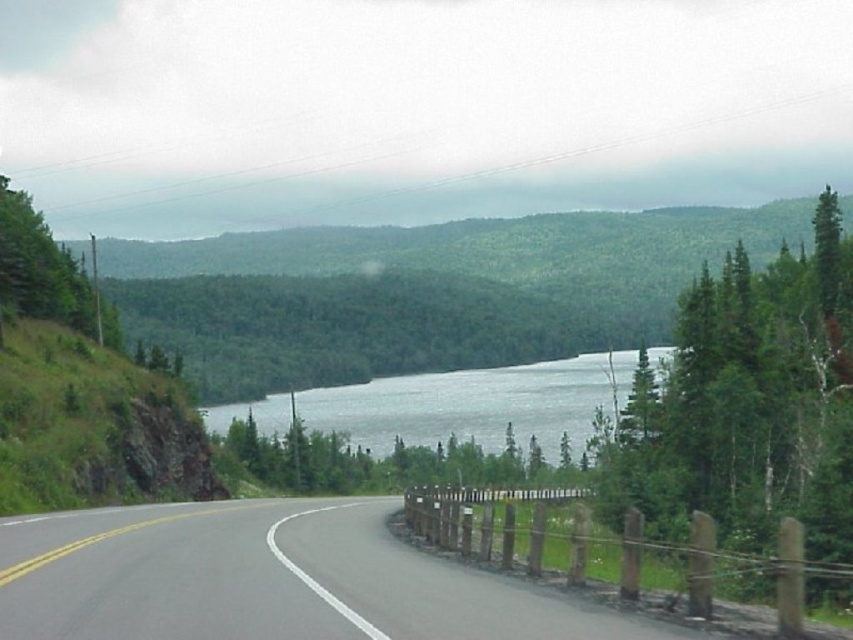
You are a hiker standing at the start of the road and want to take a photo of both the green leafy tree at upper right and the clear water at center. Which object should you position closer to the right side of your camera frame to include both in the shot?

The green leafy tree at upper right is positioned on the right side of clear water at center, so to include both in the shot, you should position the green leafy tree at upper right closer to the right side of your camera frame.

You are a driver approaching the gray asphalt highway at center and clear water at center. Which one of these two objects takes up more space in the image?

Answer: The clear water at center takes up more space in the image than the gray asphalt highway at center.